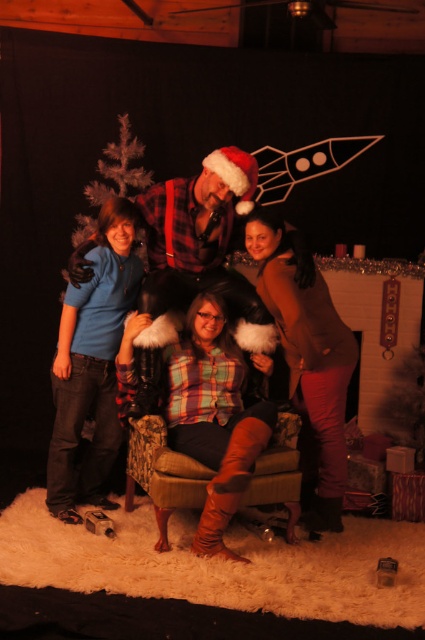
Is matte blue shirt at left bigger than brown matte sweater at upper right?

No, matte blue shirt at left is not bigger than brown matte sweater at upper right.

How far apart are matte blue shirt at left and brown matte sweater at upper right?

A distance of 3.39 feet exists between matte blue shirt at left and brown matte sweater at upper right.

From the picture: Who is more forward, (73, 474) or (300, 276)?

Point (300, 276)

Identify the location of matte blue shirt at left. This screenshot has height=640, width=425. (91, 358).

Is brown matte sweater at upper right closer to camera compared to white feathered christmas tree at left?

Yes, it is in front of white feathered christmas tree at left.

Can you confirm if brown matte sweater at upper right is positioned to the left of white feathered christmas tree at left?

No, brown matte sweater at upper right is not to the left of white feathered christmas tree at left.

From the picture: Measure the distance between point (320, 449) and camera.

3.41 meters

The height and width of the screenshot is (640, 425). In order to click on brown matte sweater at upper right in this screenshot , I will do (308, 356).

Can you confirm if matte blue shirt at left is bigger than white feathered christmas tree at left?

Yes, matte blue shirt at left is bigger than white feathered christmas tree at left.

Who is positioned more to the left, matte blue shirt at left or white feathered christmas tree at left?

white feathered christmas tree at left is more to the left.

Describe the element at coordinates (91, 358) in the screenshot. I see `matte blue shirt at left` at that location.

The height and width of the screenshot is (640, 425). I want to click on matte blue shirt at left, so click(x=91, y=358).